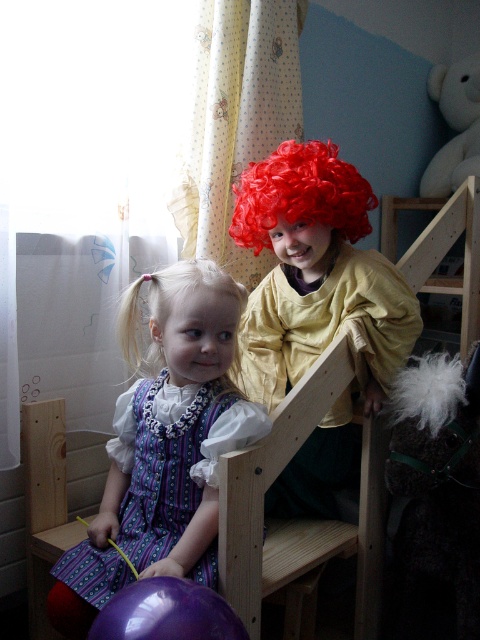
You are a photographer setting up a shot in this room. You need to place a new red stool between the purple glossy balloon at lower left and the white plush bear at upper right. Based on their current positions, which object should the stool be closer to?

The purple glossy balloon at lower left is positioned on the left side of white plush bear at upper right, so the stool should be placed closer to the purple glossy balloon at lower left to maintain the left alignment.

You are a photographer trying to capture a candid shot of the two children in the scene. You notice a purple glossy balloon at lower left marked by the point at coordinates [167,612]. Where should you position yourself to ensure the balloon is in the frame while also capturing both children?

The point at coordinates [167,612] is on the purple glossy balloon at lower left, so you should position yourself at a lower left angle to include the balloon and both children in the frame.